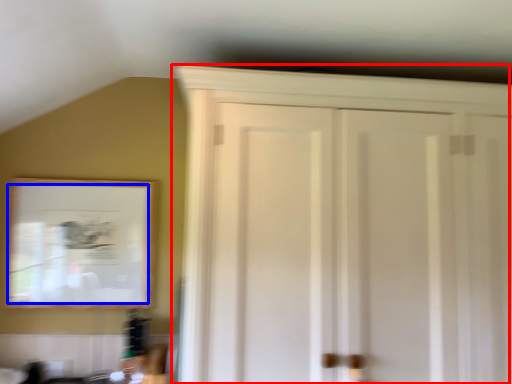
Question: Which object is closer to the camera taking this photo, cupboard (highlighted by a red box) or mirror (highlighted by a blue box)?

Choices:
 (A) cupboard
 (B) mirror

Answer: (A)